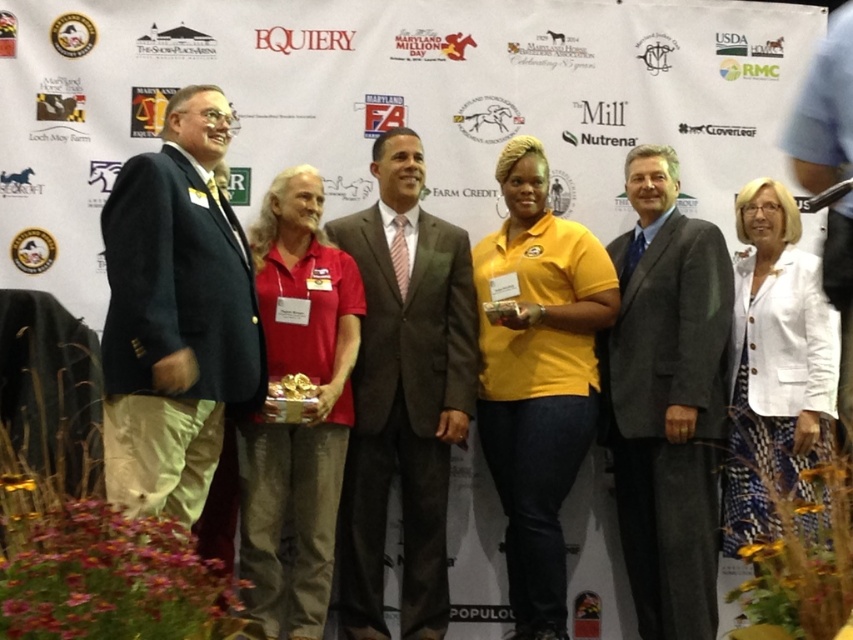
Question: Which object is farther from the camera taking this photo?

Choices:
 (A) dark blue suit at left
 (B) gray suit at center

Answer: (B)

Question: Can you confirm if brown textured suit at center is thinner than gray suit at center?

Choices:
 (A) no
 (B) yes

Answer: (A)

Question: Based on their relative distances, which object is farther from the dark blue suit at left?

Choices:
 (A) gray suit at center
 (B) brown textured suit at center

Answer: (A)

Question: Which point is farther from the camera taking this photo?

Choices:
 (A) (180, 390)
 (B) (469, 314)

Answer: (B)

Question: Does brown textured suit at center have a greater width compared to gray suit at center?

Choices:
 (A) no
 (B) yes

Answer: (B)

Question: Where is brown textured suit at center located in relation to gray suit at center in the image?

Choices:
 (A) right
 (B) left

Answer: (B)